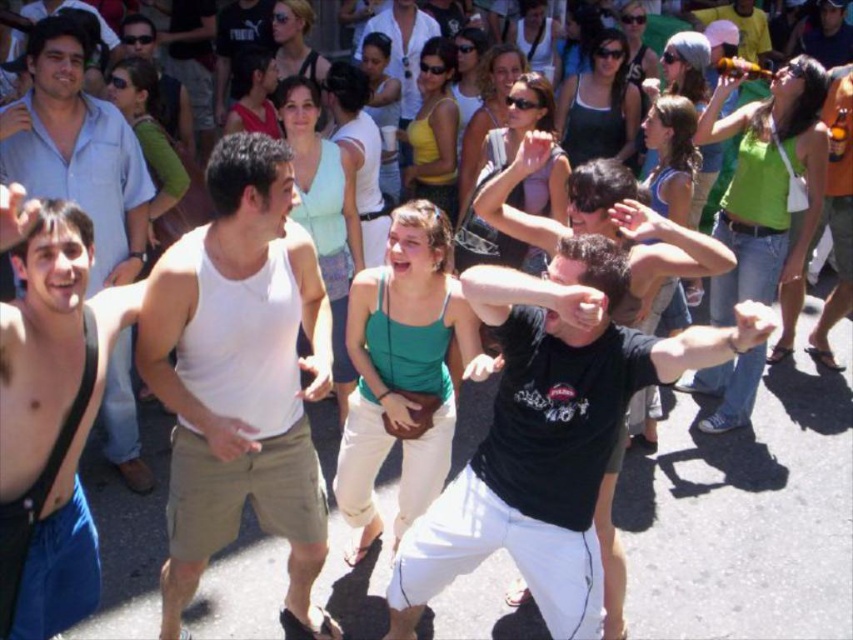
Who is shorter, black cotton t-shirt at center or shiny blue shirt at left?

shiny blue shirt at left

Is point (561, 440) positioned before point (125, 424)?

Yes, point (561, 440) is closer to viewer.

I want to click on black cotton t-shirt at center, so click(x=549, y=435).

Between black cotton t-shirt at center and shiny blue shorts at lower left, which one appears on the left side from the viewer's perspective?

Positioned to the left is shiny blue shorts at lower left.

Can you confirm if black cotton t-shirt at center is wider than shiny blue shorts at lower left?

Indeed, black cotton t-shirt at center has a greater width compared to shiny blue shorts at lower left.

Is point (581, 429) closer to camera compared to point (45, 426)?

No, (581, 429) is behind (45, 426).

Identify the location of black cotton t-shirt at center. Image resolution: width=853 pixels, height=640 pixels. (549, 435).

Is white cotton tank top at center closer to camera compared to shiny blue shirt at left?

A: That is True.

Who is lower down, white cotton tank top at center or shiny blue shirt at left?

white cotton tank top at center is below.

You are a GUI agent. You are given a task and a screenshot of the screen. Output one action in this format:
    pyautogui.click(x=<x>, y=<y>)
    Task: Click on the white cotton tank top at center
    This screenshot has width=853, height=640.
    Given the screenshot: What is the action you would take?
    pyautogui.click(x=241, y=376)